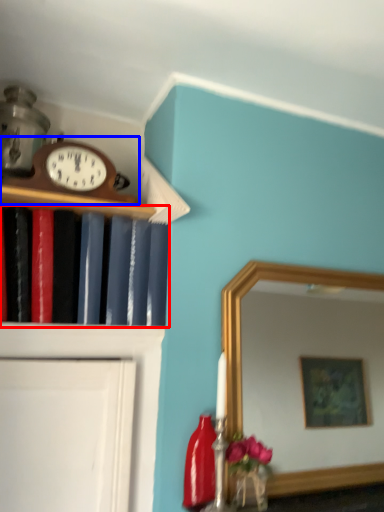
Question: Which object is further to the camera taking this photo, book (highlighted by a red box) or wall clock (highlighted by a blue box)?

Choices:
 (A) book
 (B) wall clock

Answer: (B)